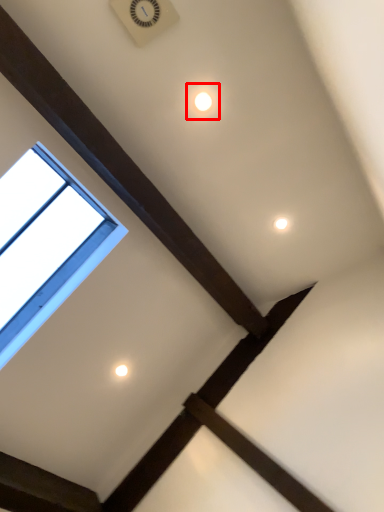
Question: From the image's perspective, what is the correct spatial relationship of dot (annotated by the red box) in relation to window?

Choices:
 (A) below
 (B) above

Answer: (B)